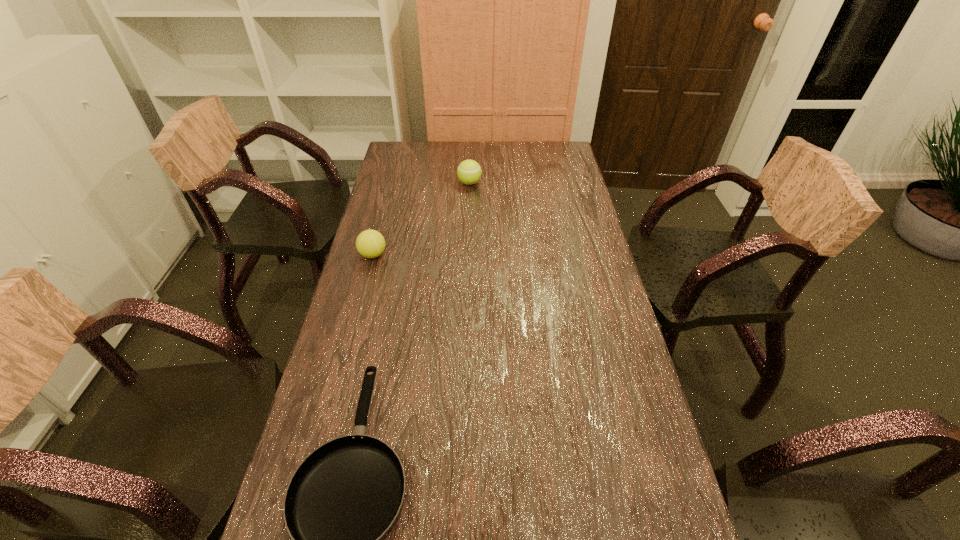
This screenshot has height=540, width=960. I want to click on the rightmost object, so click(x=469, y=172).

The width and height of the screenshot is (960, 540). What are the coordinates of `the right tennis ball` in the screenshot? It's located at (469, 172).

The height and width of the screenshot is (540, 960). Identify the location of the left tennis ball. (370, 243).

You are a GUI agent. You are given a task and a screenshot of the screen. Output one action in this format:
    pyautogui.click(x=<x>, y=<y>)
    Task: Click on the second farthest object
    The image size is (960, 540).
    Given the screenshot: What is the action you would take?
    pyautogui.click(x=370, y=243)

I want to click on free space located on the back of the rightmost object, so click(x=469, y=169).

The height and width of the screenshot is (540, 960). I want to click on vacant area situated on the right of the second farthest object, so click(442, 255).

You are a GUI agent. You are given a task and a screenshot of the screen. Output one action in this format:
    pyautogui.click(x=<x>, y=<y>)
    Task: Click on the object that is positioned at the left edge
    Image resolution: width=960 pixels, height=540 pixels.
    Given the screenshot: What is the action you would take?
    pyautogui.click(x=370, y=243)

The height and width of the screenshot is (540, 960). What are the coordinates of `vacant region at the far edge of the desktop` in the screenshot? It's located at (485, 158).

In the image, there is a desktop. Where is `vacant space at the left edge`? vacant space at the left edge is located at coordinates (339, 432).

You are a GUI agent. You are given a task and a screenshot of the screen. Output one action in this format:
    pyautogui.click(x=<x>, y=<y>)
    Task: Click on the vacant area at the right edge of the desktop
    
    Given the screenshot: What is the action you would take?
    pyautogui.click(x=597, y=302)